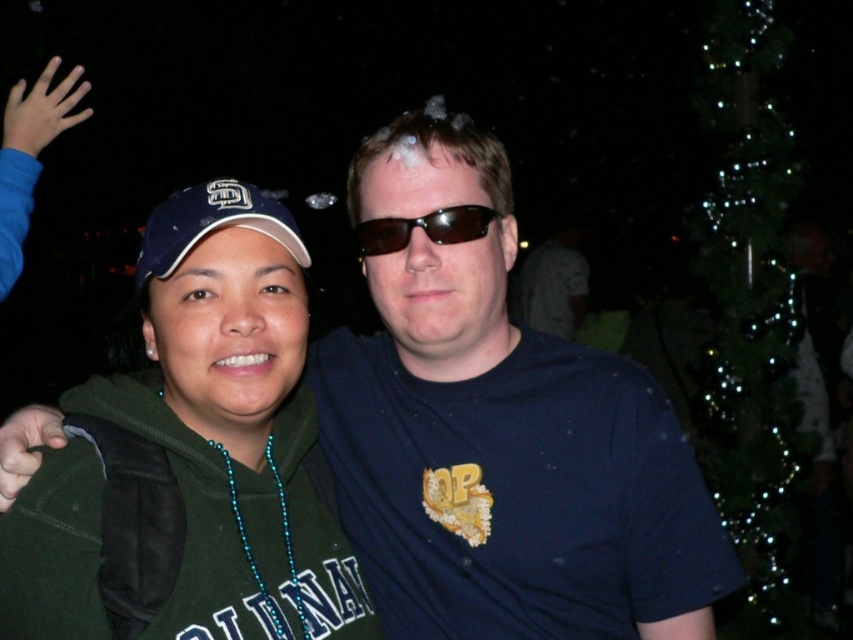
Question: Can you confirm if dark blue t-shirt at center is positioned to the left of matte blue baseball cap at left?

Choices:
 (A) no
 (B) yes

Answer: (A)

Question: Among these objects, which one is farthest from the camera?

Choices:
 (A) blue matte hand at upper left
 (B) dark skin hand at lower left
 (C) matte blue baseball cap at left
 (D) green matte hoodie at center

Answer: (A)

Question: Is green matte hoodie at center below matte blue baseball cap at left?

Choices:
 (A) no
 (B) yes

Answer: (B)

Question: Observing the image, what is the correct spatial positioning of green matte hoodie at center in reference to dark skin hand at lower left?

Choices:
 (A) left
 (B) right

Answer: (B)

Question: Which object is closer to the camera taking this photo?

Choices:
 (A) dark blue t-shirt at center
 (B) brown reflective sunglasses at center

Answer: (A)

Question: Which object appears farthest from the camera in this image?

Choices:
 (A) brown reflective sunglasses at center
 (B) matte blue baseball cap at left
 (C) green matte hoodie at center

Answer: (A)